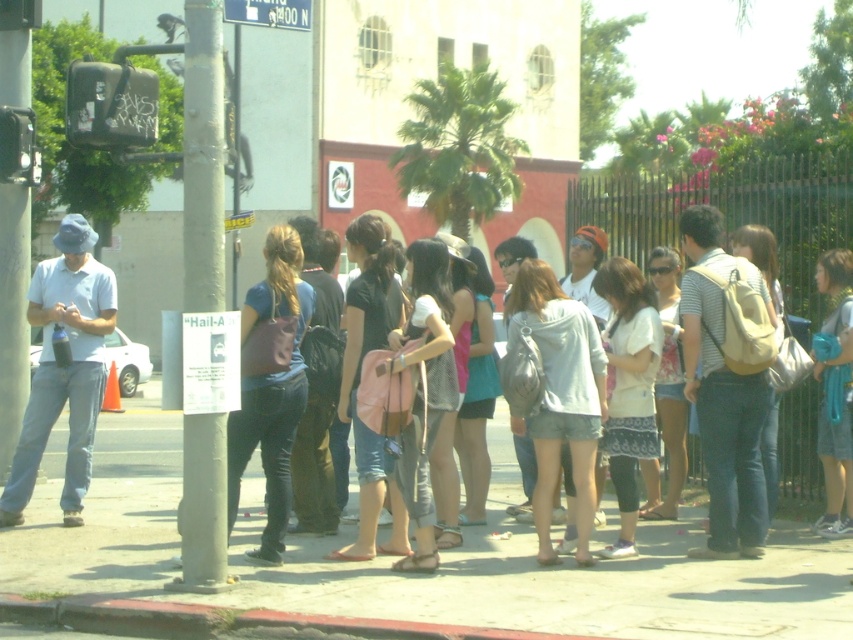
Is matte pink backpack at center smaller than red concrete curb at lower center?

Actually, matte pink backpack at center might be larger than red concrete curb at lower center.

Is point (734, 464) in front of point (166, 621)?

That is False.

Between point (534, 426) and point (97, 604), which one is positioned behind?

The point (534, 426) is behind.

The width and height of the screenshot is (853, 640). I want to click on matte pink backpack at center, so click(728, 435).

Can you confirm if smooth concrete sidewalk at center is thinner than red concrete curb at lower center?

In fact, smooth concrete sidewalk at center might be wider than red concrete curb at lower center.

Can you confirm if smooth concrete sidewalk at center is wider than red concrete curb at lower center?

Yes.

Is point (496, 589) farther from camera compared to point (25, 598)?

Yes.

At what (x,y) coordinates should I click in order to perform the action: click on smooth concrete sidewalk at center. Please return your answer as a coordinate pair (x, y). The image size is (853, 640). Looking at the image, I should click on (422, 573).

Which is more to the right, matte pink backpack at center or white plastic street sign at upper center?

Positioned to the right is matte pink backpack at center.

Can you confirm if matte pink backpack at center is wider than white plastic street sign at upper center?

Indeed, matte pink backpack at center has a greater width compared to white plastic street sign at upper center.

What do you see at coordinates (728, 435) in the screenshot?
I see `matte pink backpack at center` at bounding box center [728, 435].

Locate an element on the screen. matte pink backpack at center is located at coordinates (728, 435).